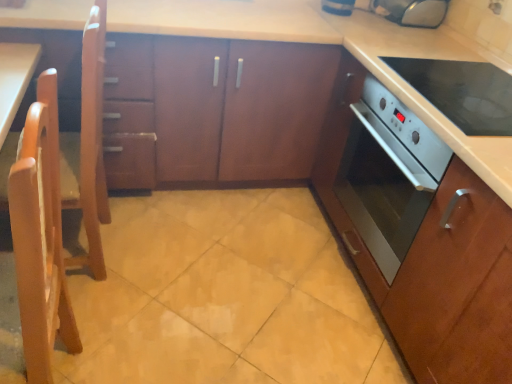
The width and height of the screenshot is (512, 384). Find the location of `free point above satin wood oven at center, marked as the second cabinetry in a left-to-right arrangement (from a real-world perspective)`. free point above satin wood oven at center, marked as the second cabinetry in a left-to-right arrangement (from a real-world perspective) is located at coordinates (428, 66).